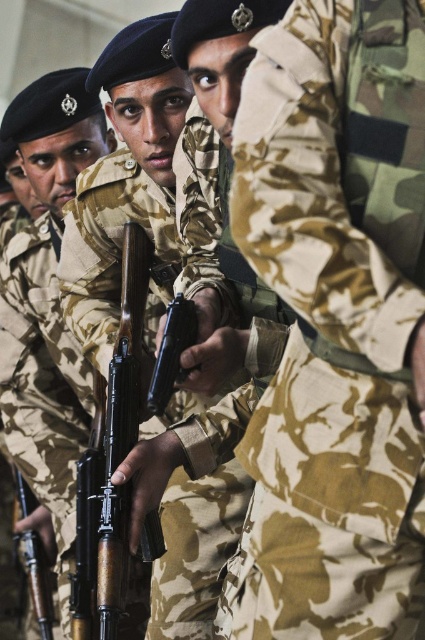
You are a military analyst reviewing this image. The camouflage fabric uniform at center is positioned at coordinates. Can you determine its exact location using the coordinate system provided?

Answer: The camouflage fabric uniform at center is exactly at point (334,324).

You are a military equipment inspector. You need to check if the camouflage fabric uniform at center can fully cover the camouflage fabric rifle at center. Based on their sizes, can the uniform cover the rifle?

The camouflage fabric uniform at center is shorter than camouflage fabric rifle at center, so the uniform cannot fully cover the rifle.